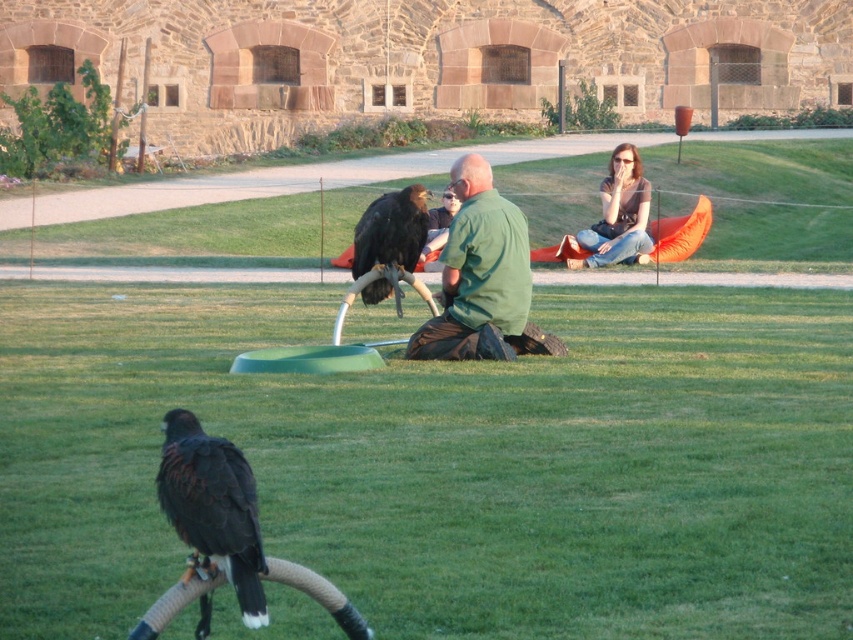
Does point (608, 209) come in front of point (376, 224)?

That is False.

Is dark brown hair at upper right wider than dark brown feathers at center?

Yes, dark brown hair at upper right is wider than dark brown feathers at center.

Who is more distant from viewer, (619,182) or (412,198)?

The point (619,182) is more distant.

The width and height of the screenshot is (853, 640). I want to click on dark brown hair at upper right, so click(x=618, y=214).

Can you confirm if green matte shirt at center is bigger than dark brown feathers at center?

Yes, green matte shirt at center is bigger than dark brown feathers at center.

Who is taller, green matte shirt at center or dark brown feathers at center?

With more height is green matte shirt at center.

Which is behind, point (469, 353) or point (393, 259)?

Point (393, 259)

Identify the location of green matte shirt at center. (480, 276).

Can you confirm if black feathered eagle at lower left is bigger than dark brown hair at upper right?

Actually, black feathered eagle at lower left might be smaller than dark brown hair at upper right.

Which is in front, point (221, 538) or point (611, 252)?

Point (221, 538)

The width and height of the screenshot is (853, 640). Find the location of `black feathered eagle at lower left`. black feathered eagle at lower left is located at coordinates (213, 508).